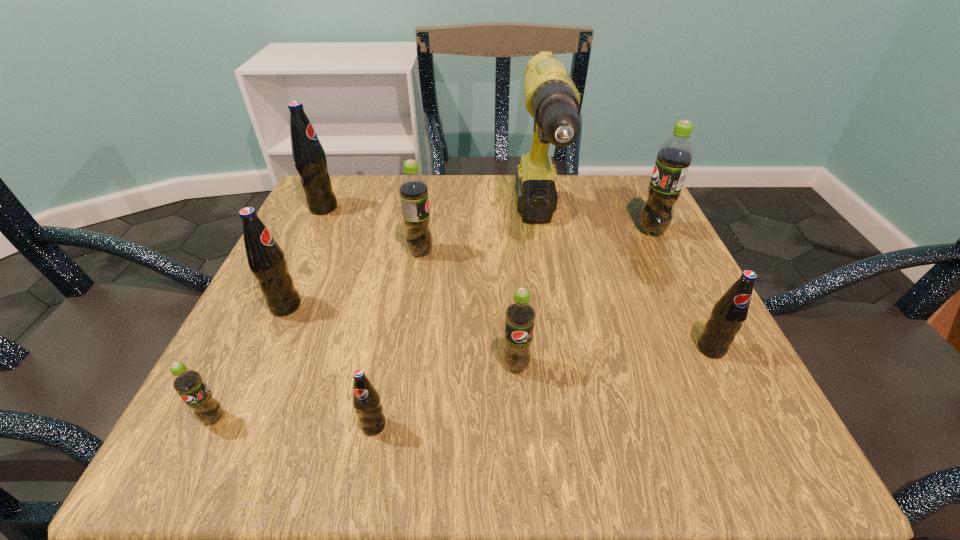
Find the location of a particular element. free location at the left edge is located at coordinates (243, 338).

Locate an element on the screen. free space at the right edge of the desktop is located at coordinates (620, 247).

The width and height of the screenshot is (960, 540). Identify the location of free point at the far left corner. (376, 177).

The image size is (960, 540). Identify the location of vacant space at the near left corner. (283, 443).

The width and height of the screenshot is (960, 540). In order to click on empty location between the sixth nearest soda and the smallest green soda in this screenshot , I will do `click(317, 335)`.

Where is `free space that is in between the third farthest soda and the tallest object`? free space that is in between the third farthest soda and the tallest object is located at coordinates 479,242.

This screenshot has height=540, width=960. I want to click on free space between the rightmost black pop and the second farthest black pop, so click(x=498, y=327).

This screenshot has width=960, height=540. Find the location of `unoccupied position between the smallest green soda and the third green soda from right to left`. unoccupied position between the smallest green soda and the third green soda from right to left is located at coordinates (317, 335).

In order to click on vacant space that's between the third nearest black pop and the farthest soda in this screenshot , I will do `click(304, 256)`.

Image resolution: width=960 pixels, height=540 pixels. Identify the location of vacant point located between the third black pop from left to right and the drill. (456, 329).